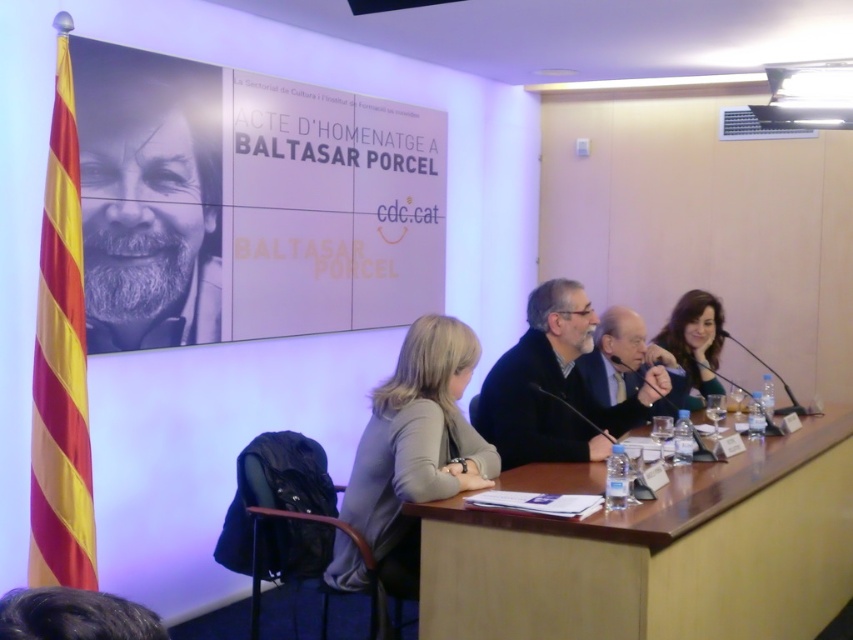
Question: Can you confirm if black paper at upper left is positioned above gray beard at upper left?

Choices:
 (A) yes
 (B) no

Answer: (A)

Question: Which is farther from the gray beard at upper left?

Choices:
 (A) dark brown hair at lower left
 (B) gray hair man at center
 (C) smooth skin face at upper right

Answer: (A)

Question: Does black paper at upper left have a smaller size compared to gray hair man at center?

Choices:
 (A) no
 (B) yes

Answer: (A)

Question: Estimate the real-world distances between objects in this image. Which object is closer to the smooth skin face at upper right?

Choices:
 (A) brown wood table at center
 (B) dark blue sweater at center
 (C) black paper at upper left
 (D) gray hair man at center

Answer: (D)

Question: Can you confirm if brown wood table at center is bigger than gray fabric jacket at lower left?

Choices:
 (A) yes
 (B) no

Answer: (A)

Question: Which point appears closest to the camera in this image?

Choices:
 (A) (117, 84)
 (B) (39, 628)
 (C) (611, 580)

Answer: (B)